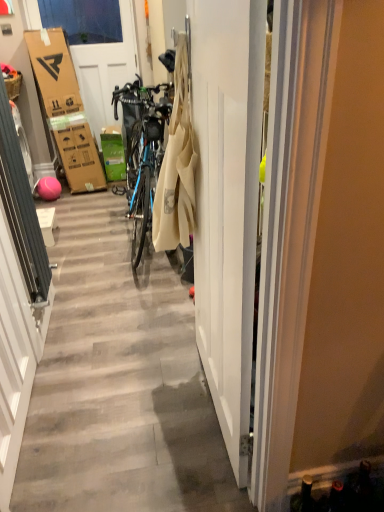
Question: Considering the relative sizes of matte blue bicycle at center and matte brown picnic basket at left in the image provided, is matte blue bicycle at center taller than matte brown picnic basket at left?

Choices:
 (A) yes
 (B) no

Answer: (A)

Question: Is matte blue bicycle at center further to camera compared to matte brown picnic basket at left?

Choices:
 (A) yes
 (B) no

Answer: (B)

Question: Can you confirm if matte blue bicycle at center is positioned to the left of matte brown picnic basket at left?

Choices:
 (A) no
 (B) yes

Answer: (A)

Question: From the image's perspective, is matte blue bicycle at center below matte brown picnic basket at left?

Choices:
 (A) no
 (B) yes

Answer: (B)

Question: From a real-world perspective, is matte blue bicycle at center over matte brown picnic basket at left?

Choices:
 (A) no
 (B) yes

Answer: (A)

Question: From a real-world perspective, does matte blue bicycle at center sit lower than matte brown picnic basket at left?

Choices:
 (A) no
 (B) yes

Answer: (B)

Question: Can you confirm if white cardboard at upper left, positioned as the 2th door in bottom-to-top order, is wider than white glossy door at center, marked as the first door in a right-to-left arrangement?

Choices:
 (A) no
 (B) yes

Answer: (A)

Question: Considering the relative sizes of white cardboard at upper left, positioned as the first door in back-to-front order, and white glossy door at center, the 2th door viewed from the top, in the image provided, is white cardboard at upper left, positioned as the first door in back-to-front order, shorter than white glossy door at center, the 2th door viewed from the top,?

Choices:
 (A) no
 (B) yes

Answer: (A)

Question: From the image's perspective, is white cardboard at upper left, acting as the second door starting from the front, over white glossy door at center, the first door positioned from the front?

Choices:
 (A) no
 (B) yes

Answer: (B)

Question: Does white cardboard at upper left, acting as the second door starting from the front, lie behind white glossy door at center, which is counted as the 2th door, starting from the back?

Choices:
 (A) yes
 (B) no

Answer: (A)

Question: Is white cardboard at upper left, positioned as the first door in back-to-front order, far away from white glossy door at center, arranged as the 1th door when ordered from the bottom?

Choices:
 (A) yes
 (B) no

Answer: (A)

Question: Is white cardboard at upper left, positioned as the first door in back-to-front order, oriented away from white glossy door at center, the first door positioned from the front?

Choices:
 (A) yes
 (B) no

Answer: (B)

Question: From a real-world perspective, is matte blue bicycle at center physically below white glossy door at center, the 2th door viewed from the top?

Choices:
 (A) yes
 (B) no

Answer: (A)